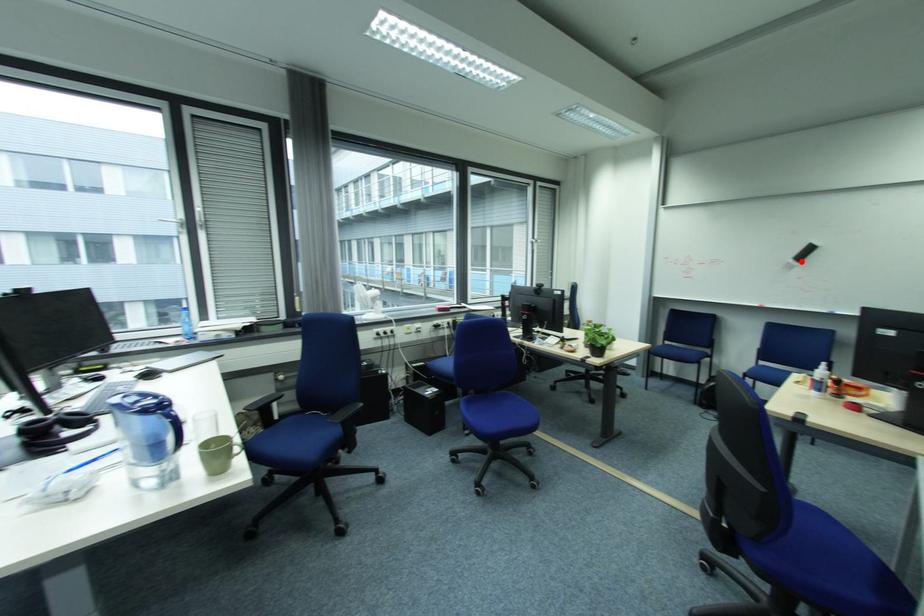
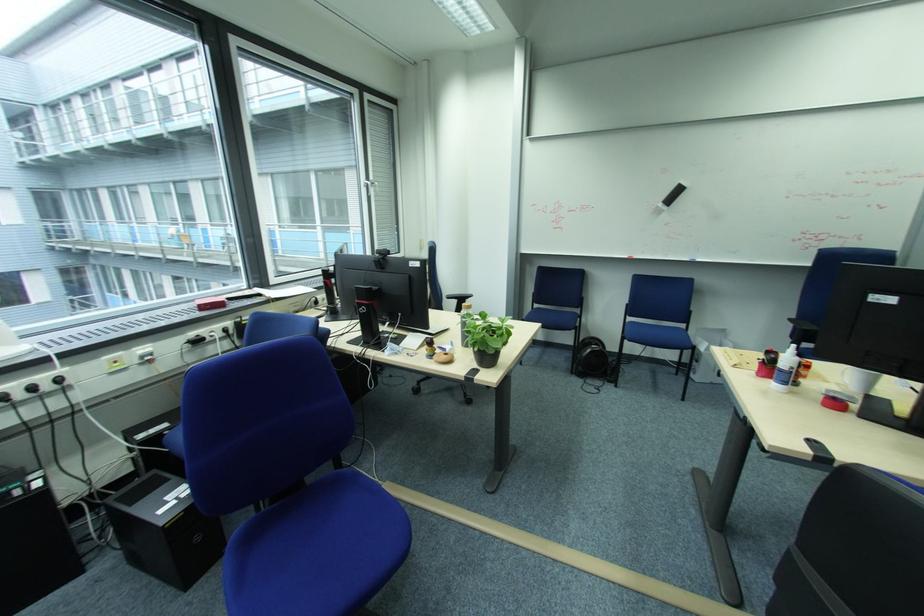
Question: I am providing you with two images of the same scene from different viewpoints. A red point is shown in image1. For the corresponding object point in image2, is it positioned nearer or farther from the camera?

Choices:
 (A) Nearer
 (B) Farther

Answer: (A)